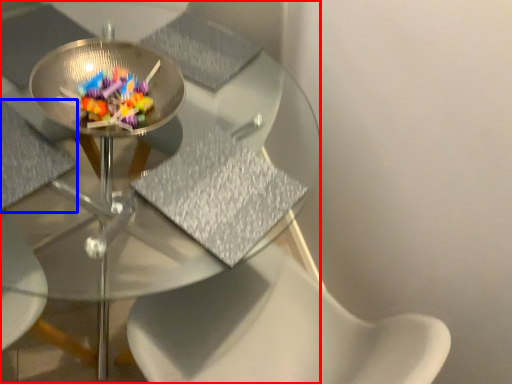
Question: Among these objects, which one is farthest to the camera, table (highlighted by a red box) or chair (highlighted by a blue box)?

Choices:
 (A) table
 (B) chair

Answer: (B)